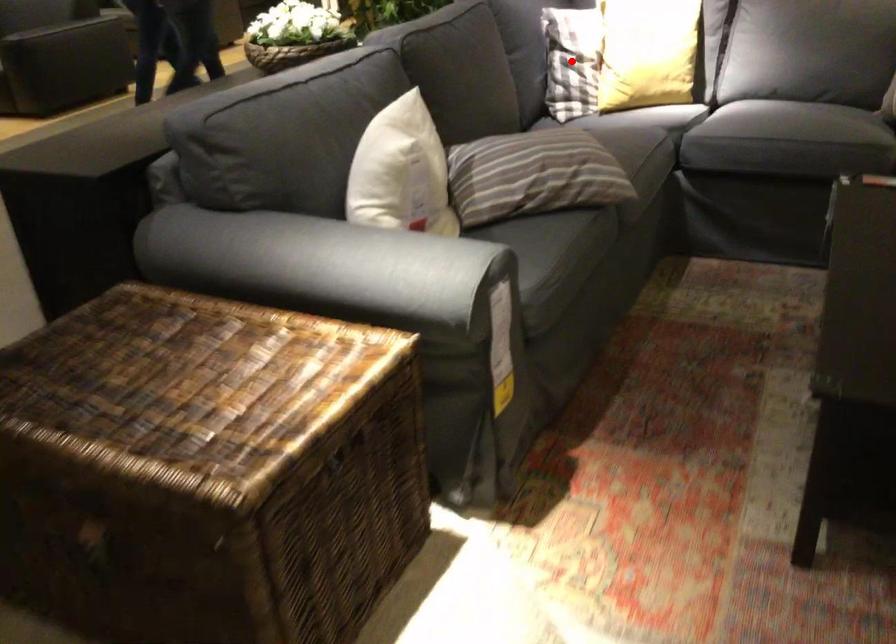
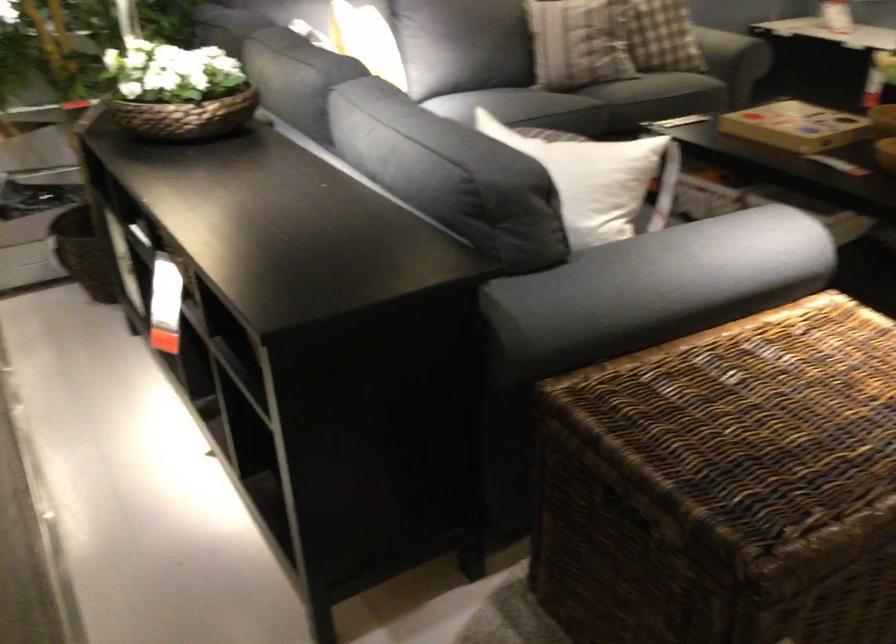
Question: I am providing you with two images of the same scene from different viewpoints. A red point is marked on the first image. Is the red point's position out of view in image 2?

Choices:
 (A) Yes
 (B) No

Answer: (A)